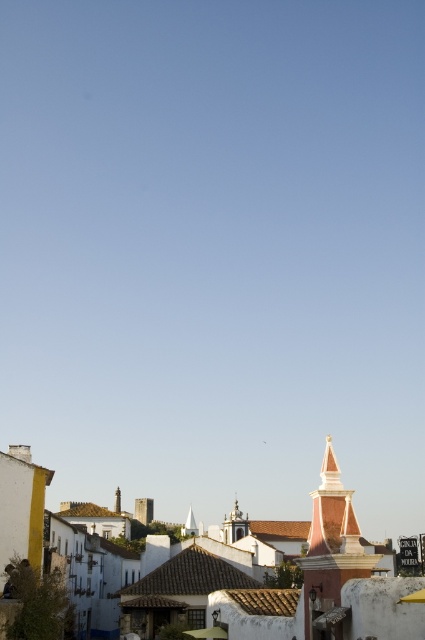
Can you confirm if white textured building at lower center is shorter than silver metallic tower at center?

No.

Between white textured building at lower center and silver metallic tower at center, which one has more height?

white textured building at lower center

Locate an element on the screen. The height and width of the screenshot is (640, 425). white textured building at lower center is located at coordinates (209, 592).

Is smooth pink tower at center shorter than silver metallic tower at center?

No.

Between smooth pink tower at center and silver metallic tower at center, which one has more height?

smooth pink tower at center

At what (x,y) coordinates should I click in order to perform the action: click on smooth pink tower at center. Please return your answer as a coordinate pair (x, y). The height and width of the screenshot is (640, 425). Looking at the image, I should click on (331, 545).

Who is lower down, silver metallic tower at center or pink stucco spire at center?

pink stucco spire at center is lower down.

Does point (232, 538) come closer to viewer compared to point (116, 497)?

Yes.

The height and width of the screenshot is (640, 425). I want to click on silver metallic tower at center, so click(x=235, y=525).

At what (x,y) coordinates should I click in order to perform the action: click on silver metallic tower at center. Please return your answer as a coordinate pair (x, y). The height and width of the screenshot is (640, 425). Looking at the image, I should click on (235, 525).